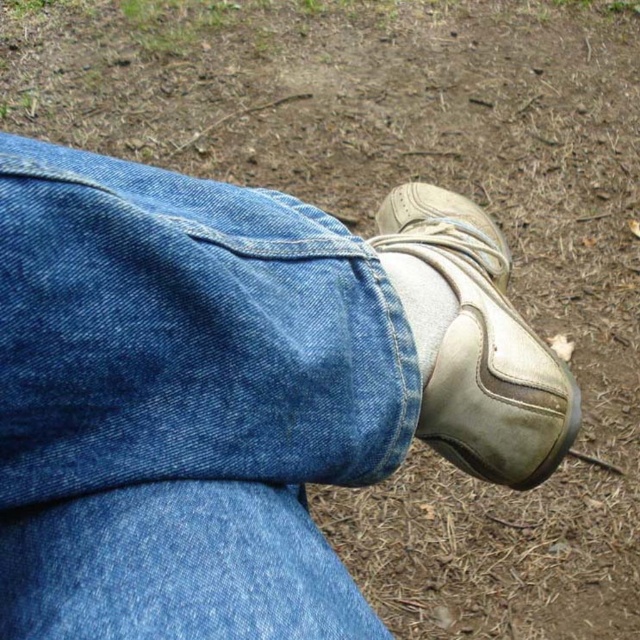
Question: Can you confirm if denim at lower right is bigger than white leather shoe at lower center?

Choices:
 (A) no
 (B) yes

Answer: (A)

Question: Does denim at lower right appear over white leather shoe at lower center?

Choices:
 (A) yes
 (B) no

Answer: (B)

Question: Among these objects, which one is nearest to the camera?

Choices:
 (A) white leather shoe at lower center
 (B) denim at lower right

Answer: (B)

Question: Is denim at lower right below white leather shoe at lower center?

Choices:
 (A) yes
 (B) no

Answer: (A)

Question: Which point is closer to the camera?

Choices:
 (A) (566, 369)
 (B) (148, 348)

Answer: (B)